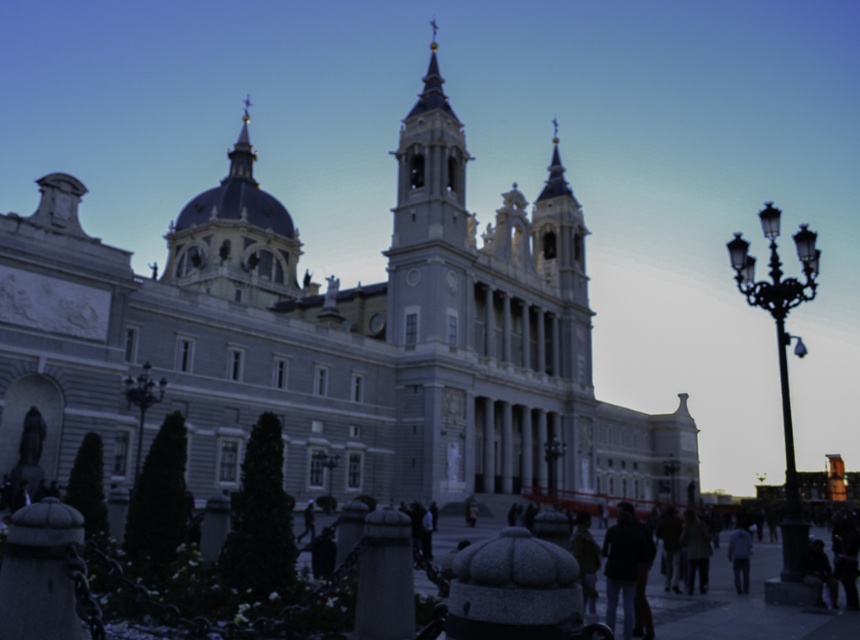
You are standing at the entrance of the cathedral and notice two points marked on the building. The first point is at coordinates point (243, 196) and the second is at point (740, 541). From your vantage point at the entrance, which point is closer to you?

Point (740, 541) is closer to you because it is in front of point (243, 196) according to their spatial relationship.

You are standing at the entrance of the grand historic building and notice a gold domed dome at upper center and a light blue fabric jacket at lower right. Which object is farther from your current position?

The gold domed dome at upper center is farther from your current position than the light blue fabric jacket at lower right since it is 252.42 feet away.

You are standing in front of the gray stone church at center and the smooth stone tower at center. Which one is positioned to the left?

The gray stone church at center is positioned to the left of the smooth stone tower at center.